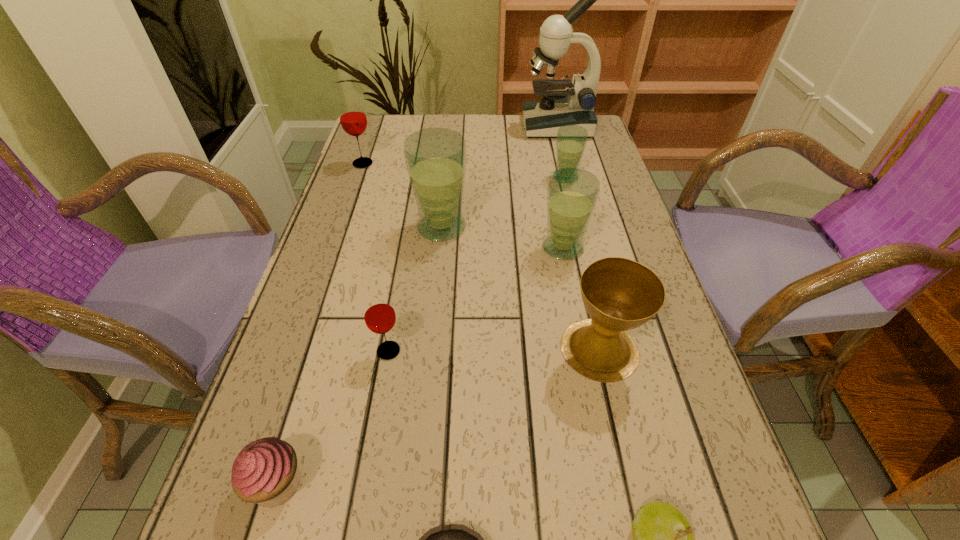
Identify which blue glass is the second closest to the biggest blue glass. Please provide its 2D coordinates. Your answer should be formatted as a tuple, i.e. [(x, y)], where the tuple contains the x and y coordinates of a point satisfying the conditions above.

[(571, 140)]

Choose which blue glass is the nearest neighbor to the farther red glass. Please provide its 2D coordinates. Your answer should be formatted as a tuple, i.e. [(x, y)], where the tuple contains the x and y coordinates of a point satisfying the conditions above.

[(435, 158)]

Where is `free space that satisfies the following two spatial constraints: 1. on the front side of the pink cupcake; 2. on the left side of the leftmost glass`? free space that satisfies the following two spatial constraints: 1. on the front side of the pink cupcake; 2. on the left side of the leftmost glass is located at coordinates (253, 484).

Find the location of a particular element. This screenshot has height=540, width=960. vacant space that satisfies the following two spatial constraints: 1. at the eyepiece of the microscope; 2. on the front side of the second biggest blue glass is located at coordinates (588, 248).